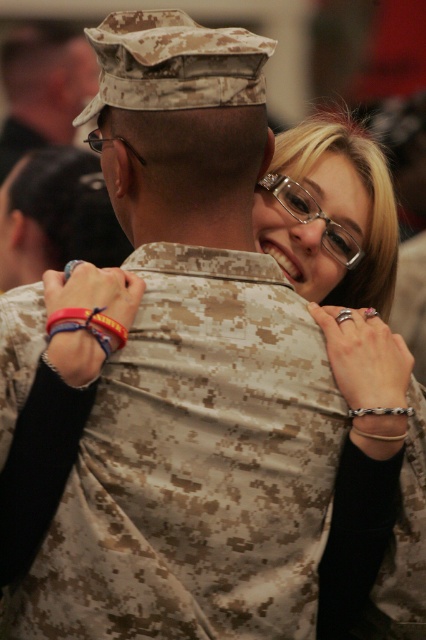
You are a photographer trying to capture a closeup of the matte black glasses at upper right and the camouflage uniform at center. Which object should you zoom in on to ensure both are in focus without moving the camera?

The matte black glasses at upper right has a smaller size compared to camouflage uniform at center, so you should zoom in on the camouflage uniform at center to ensure both are in focus without moving the camera.

You are a photographer trying to capture the perfect shot of the matte black glasses at upper right and the camouflage uniform at upper left. To ensure both are in focus, you need to know their positions relative to each other. Which object is positioned more to the right side of the scene?

The matte black glasses at upper right is positioned more to the right side of the scene compared to the camouflage uniform at upper left.